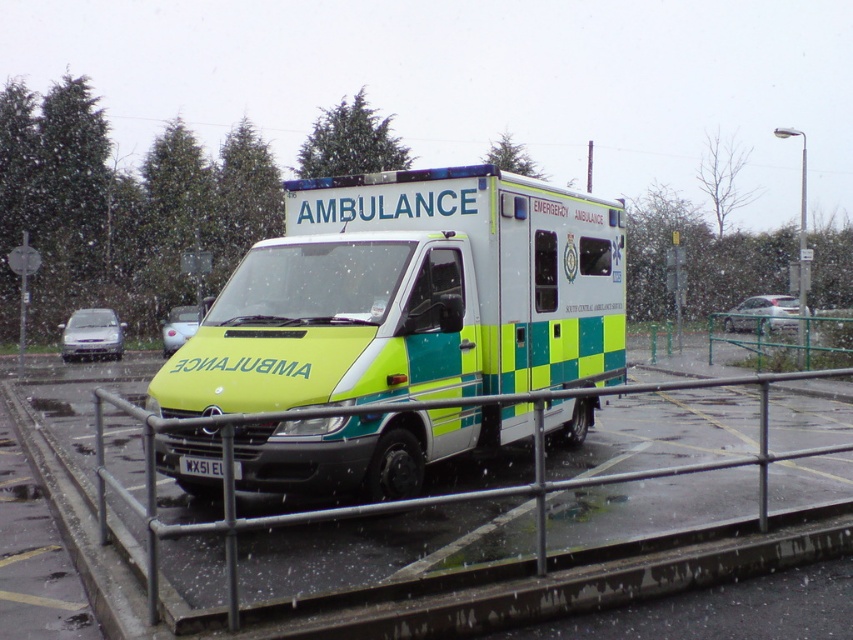
Question: Does metal/textured rail at lower center come in front of metallic silver car at left?

Choices:
 (A) yes
 (B) no

Answer: (A)

Question: Which point is farther from the camera taking this photo?

Choices:
 (A) (178, 330)
 (B) (392, 380)
 (C) (310, 516)
 (D) (788, 321)

Answer: (A)

Question: Is yellow-green checkered ambulance at center wider than metallic silver car at left?

Choices:
 (A) no
 (B) yes

Answer: (A)

Question: Does metal/textured rail at lower center appear under metallic silver car at left?

Choices:
 (A) yes
 (B) no

Answer: (A)

Question: Which point is farther from the camera taking this photo?

Choices:
 (A) (82, 320)
 (B) (233, 378)
 (C) (177, 308)
 (D) (282, 515)

Answer: (C)

Question: Which point is farther to the camera?

Choices:
 (A) (177, 310)
 (B) (317, 205)
 (C) (683, 385)
 (D) (73, 323)

Answer: (A)